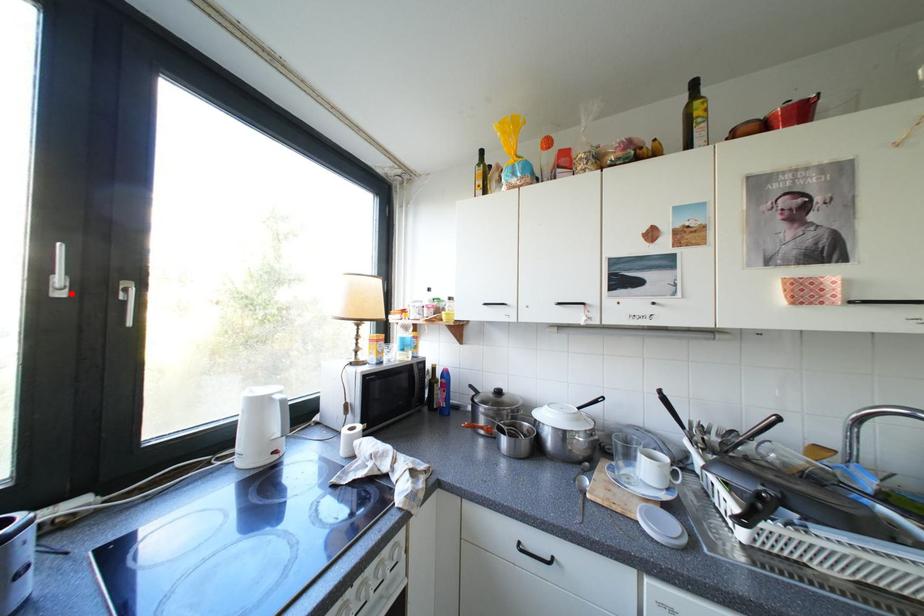
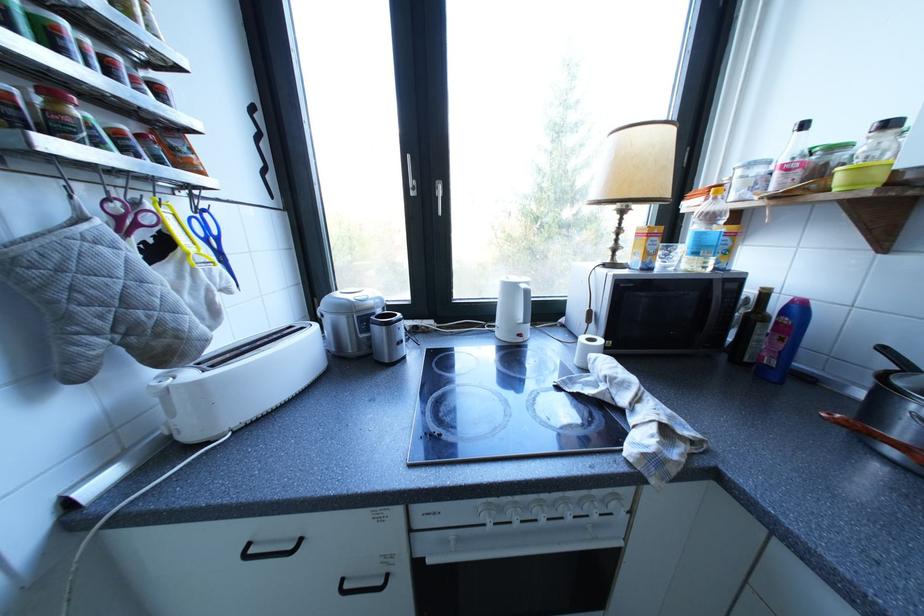
Locate, in the second image, the point that corresponds to the highlighted location in the first image.

(426, 193)